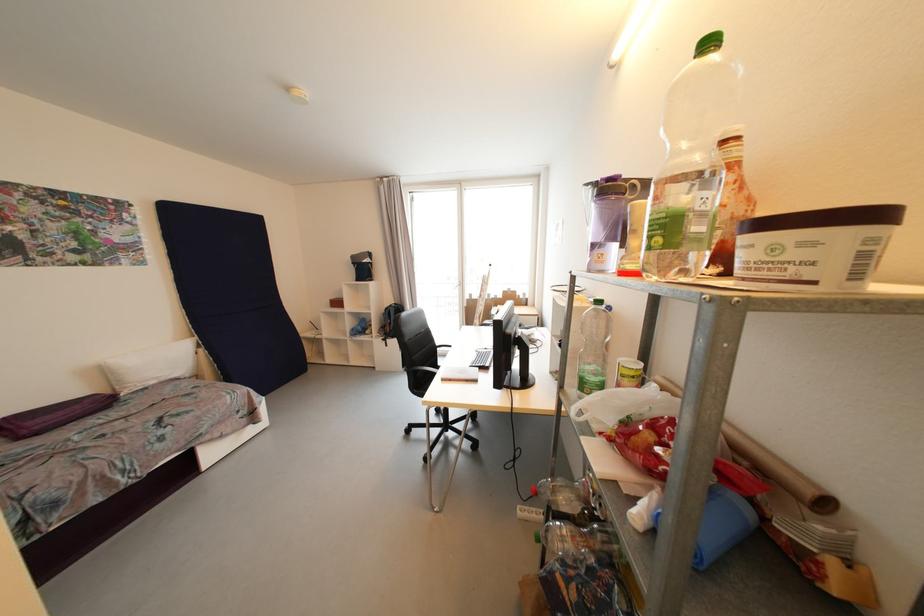
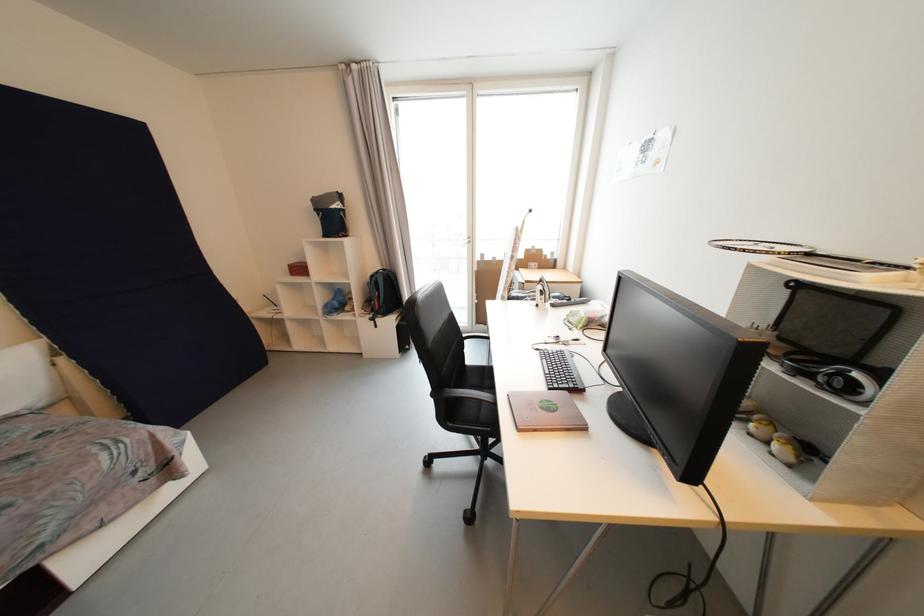
Question: How did the camera likely rotate?

Choices:
 (A) Left
 (B) Right
 (C) Up
 (D) Down

Answer: (D)